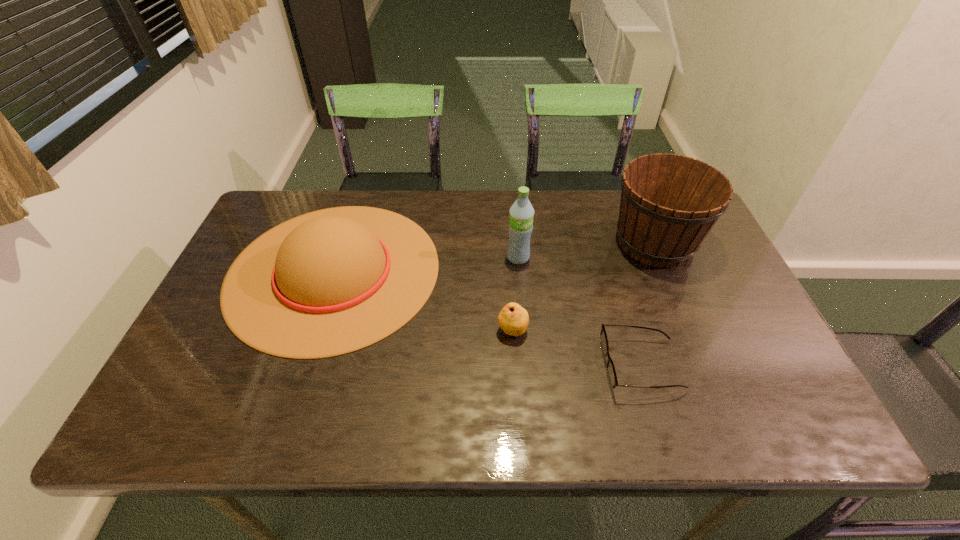
Find the location of a particular element. The image size is (960, 540). water bottle is located at coordinates (520, 226).

At what (x,y) coordinates should I click in order to perform the action: click on wine bucket. Please return your answer as a coordinate pair (x, y). The height and width of the screenshot is (540, 960). Looking at the image, I should click on (669, 203).

Where is `sombrero`? sombrero is located at coordinates (330, 282).

This screenshot has width=960, height=540. Identify the location of the leftmost object. (330, 282).

Locate an element on the screen. This screenshot has height=540, width=960. pear is located at coordinates (513, 319).

Identify the location of spectacles. (611, 372).

The width and height of the screenshot is (960, 540). What are the coordinates of `vacant region located 0.110m on the left of the water bottle` in the screenshot? It's located at (468, 258).

Identify the location of vacant region located 0.220m on the front of the wine bucket. The width and height of the screenshot is (960, 540). (696, 342).

At what (x,y) coordinates should I click in order to perform the action: click on vacant space located 0.340m on the right of the sombrero. Please return your answer as a coordinate pair (x, y). This screenshot has width=960, height=540. Looking at the image, I should click on (563, 271).

You are a GUI agent. You are given a task and a screenshot of the screen. Output one action in this format:
    pyautogui.click(x=<x>, y=<y>)
    Task: Click on the free space located on the front of the fourth tallest object
    The width and height of the screenshot is (960, 540).
    Given the screenshot: What is the action you would take?
    pos(515,363)